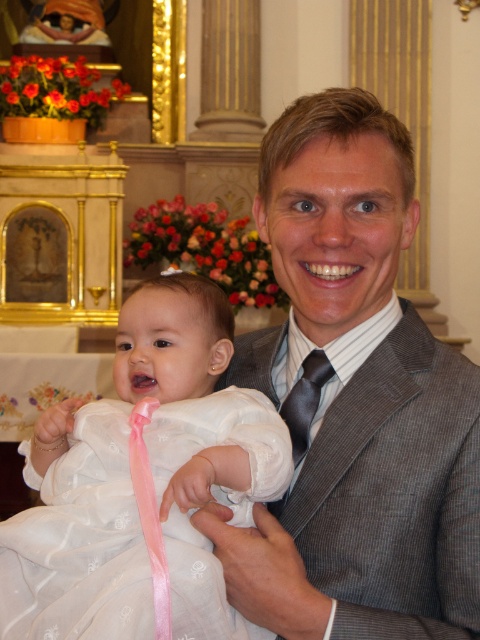
In the scene shown: You are a photographer standing at the back of the church and want to take a photo of the white satin dress at center and the dark brown silk tie at center. If your camera has a maximum focus range of 3.5 feet, can you capture both subjects clearly in the same frame without moving closer?

The white satin dress at center is 3.70 feet away from the dark brown silk tie at center. Since the distance between them exceeds the camera maximum focus range of 3.5 feet, you cannot capture both subjects clearly in the same frame without moving closer.

You are an event planner organizing a photoshoot in this church scene. You need to place a small decorative item exactly at the location marked by point (360,403). What object or area in the scene is located at this point?

The point (360,403) marks the gray textured suit at center.